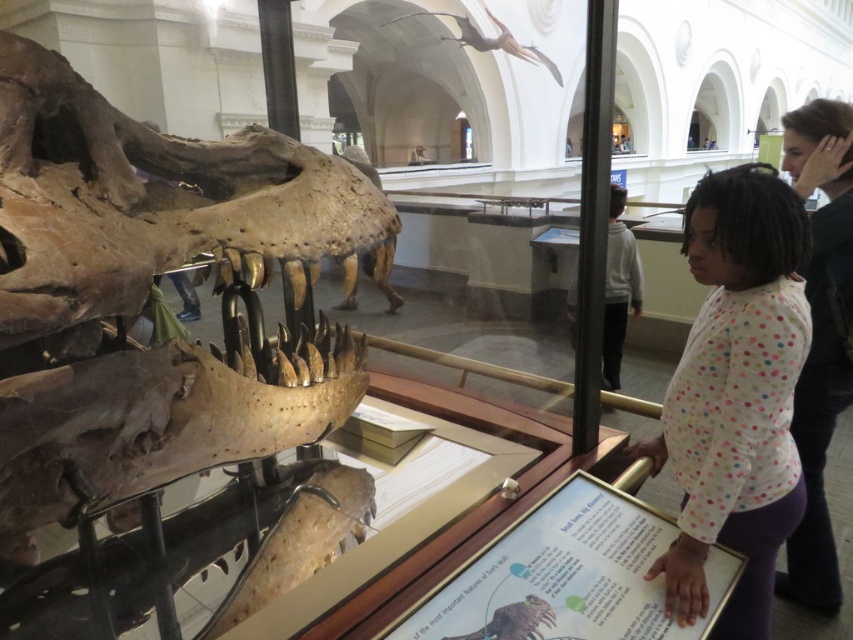
Question: Estimate the real-world distances between objects in this image. Which object is farther from the matte black hair at upper right?

Choices:
 (A) white polka dot shirt at center
 (B) brown rough skull at center

Answer: (B)

Question: From the image, what is the correct spatial relationship of white polka dot shirt at center in relation to matte black hair at upper right?

Choices:
 (A) right
 (B) left

Answer: (B)

Question: Based on their relative distances, which object is farther from the white polka dot shirt at center?

Choices:
 (A) brown rough skull at center
 (B) matte black hair at upper right

Answer: (A)

Question: Which object is closer to the camera taking this photo?

Choices:
 (A) brown rough skull at center
 (B) matte black hair at upper right

Answer: (A)

Question: Does brown rough skull at center lie behind white polka dot shirt at center?

Choices:
 (A) no
 (B) yes

Answer: (A)

Question: Where is brown rough skull at center located in relation to white polka dot shirt at center in the image?

Choices:
 (A) above
 (B) below

Answer: (A)